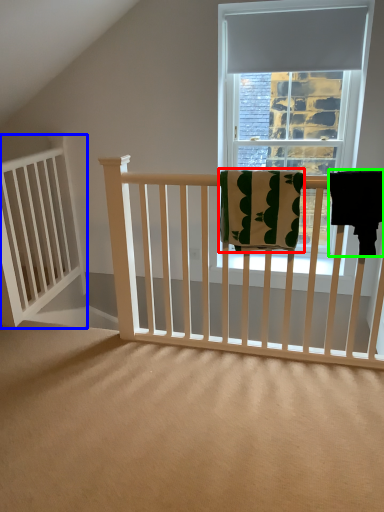
Question: Which object is positioned farthest from beach towel (highlighted by a red box)? Select from balustrade (highlighted by a blue box) and beach towel (highlighted by a green box).

Choices:
 (A) balustrade
 (B) beach towel

Answer: (A)